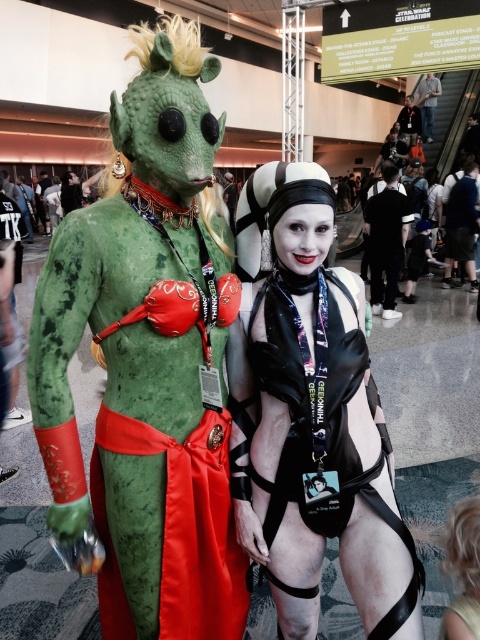
Question: Among these objects, which one is farthest from the camera?

Choices:
 (A) green matte skin zombie at center
 (B) satin black bodysuit at center
 (C) denim jacket at center
 (D) dark blue fabric pants at right

Answer: (C)

Question: Considering the real-world distances, which object is closest to the dark blue fabric pants at right?

Choices:
 (A) black leather jacket at center
 (B) green matte skin zombie at center
 (C) satin black bodysuit at center

Answer: (A)

Question: Does black leather jacket at center have a lesser width compared to dark blue fabric pants at right?

Choices:
 (A) yes
 (B) no

Answer: (A)

Question: Does satin black bodysuit at center appear under matte black helmet at upper center?

Choices:
 (A) no
 (B) yes

Answer: (B)

Question: Does dark blue fabric pants at right have a smaller size compared to denim jacket at center?

Choices:
 (A) no
 (B) yes

Answer: (B)

Question: Among these points, which one is farthest from the camera?

Choices:
 (A) (431, 92)
 (B) (168, 392)
 (C) (377, 209)
 (D) (407, 108)

Answer: (A)